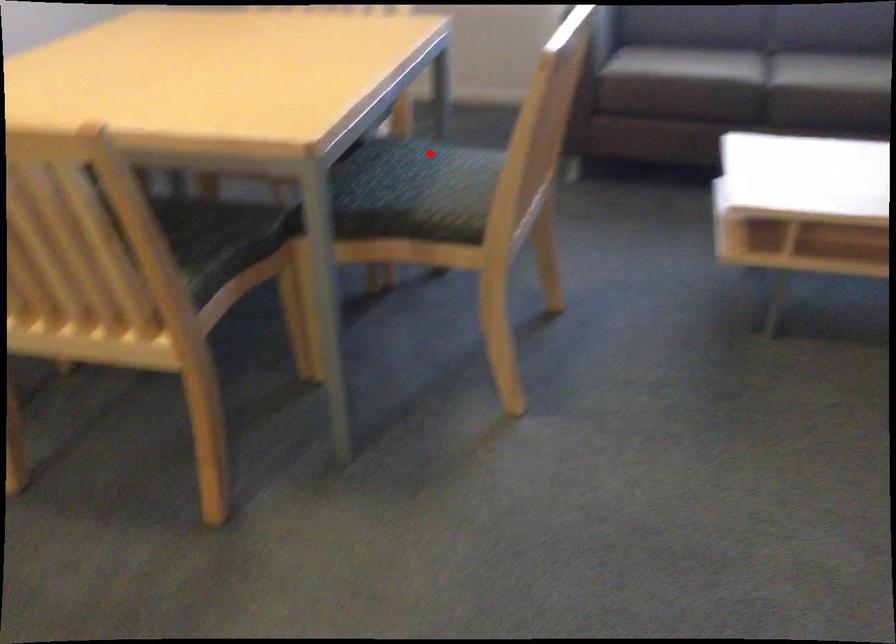
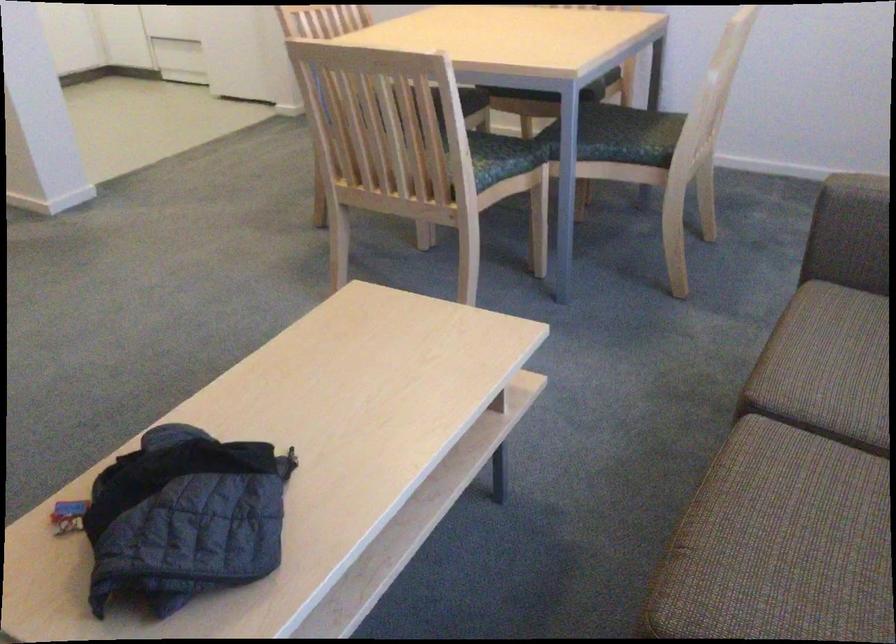
Find the pixel in the second image that matches the highlighted location in the first image.

(501, 158)